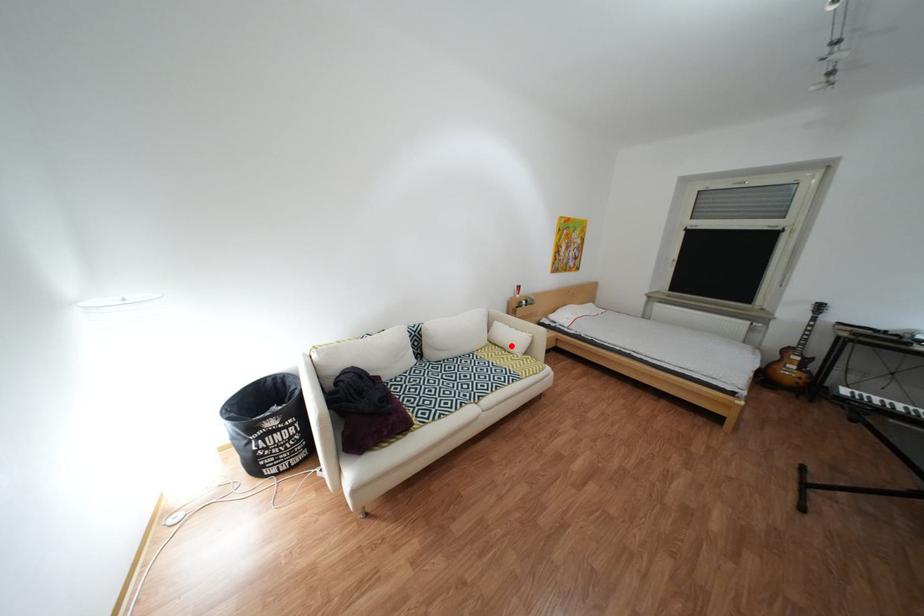
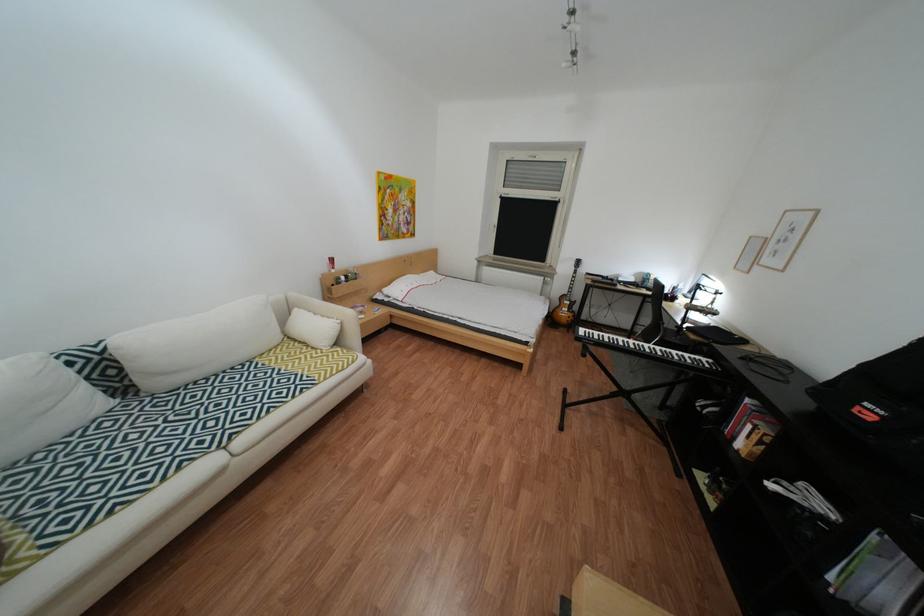
Find the pixel in the second image that matches the highlighted location in the first image.

(311, 342)